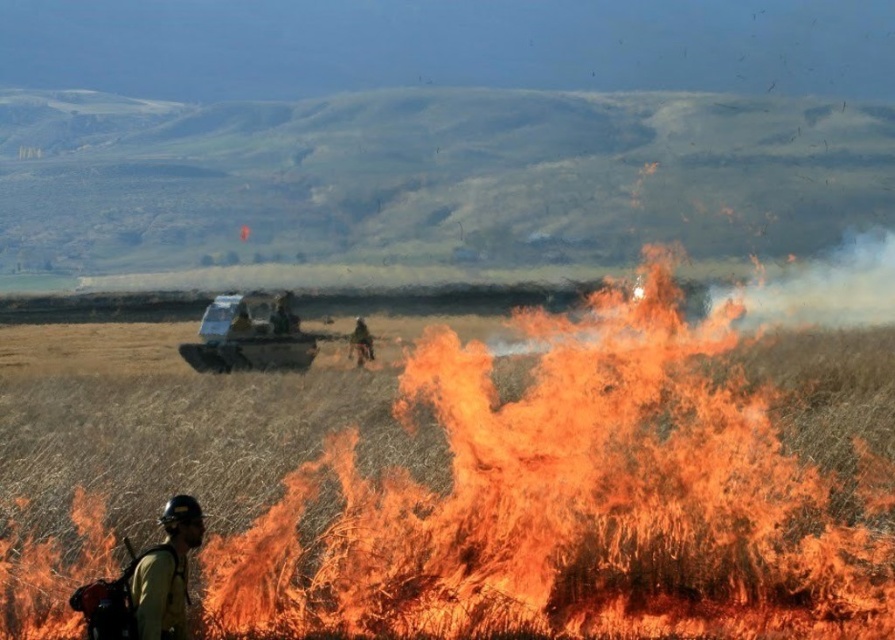
Question: Among these points, which one is nearest to the camera?

Choices:
 (A) (186, 506)
 (B) (245, 337)

Answer: (A)

Question: Which point appears farthest from the camera in this image?

Choices:
 (A) (173, 529)
 (B) (246, 458)

Answer: (B)

Question: Is grassy field at center above camouflage fabric jacket at center?

Choices:
 (A) yes
 (B) no

Answer: (A)

Question: In this image, where is grassy field at center located relative to camouflage fabric jacket at center?

Choices:
 (A) right
 (B) left

Answer: (A)

Question: Which object appears closest to the camera in this image?

Choices:
 (A) matte silver tank at center
 (B) yellow-green uniform at lower left
 (C) grassy field at center

Answer: (B)

Question: Is matte silver tank at center in front of yellow-green uniform at lower left?

Choices:
 (A) no
 (B) yes

Answer: (A)